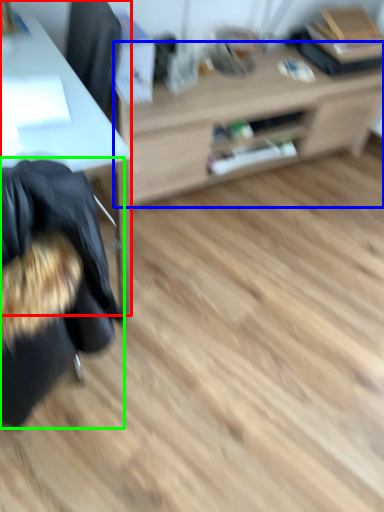
Question: Which object is positioned closest to desk (highlighted by a red box)? Select from table (highlighted by a blue box) and bean bag chair (highlighted by a green box).

Choices:
 (A) table
 (B) bean bag chair

Answer: (B)